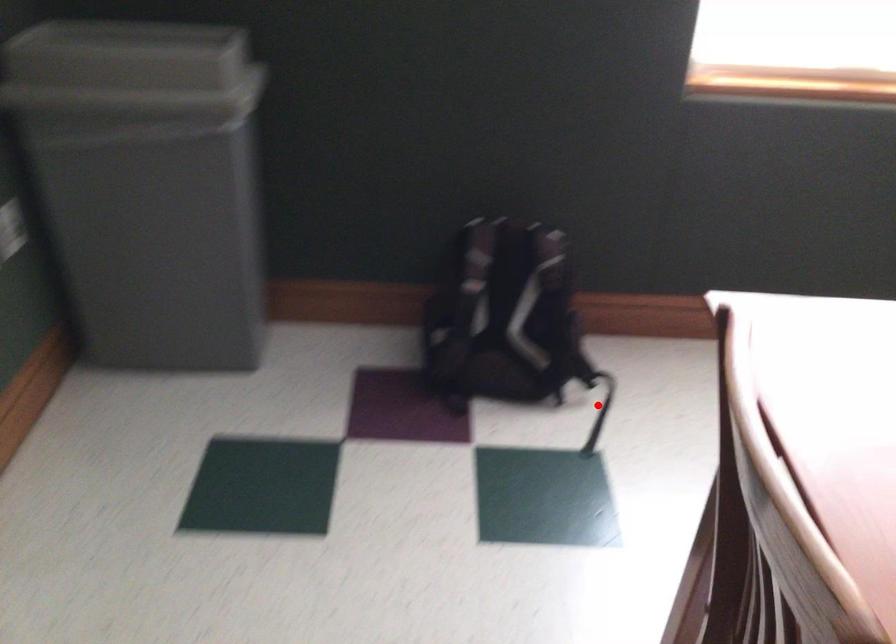
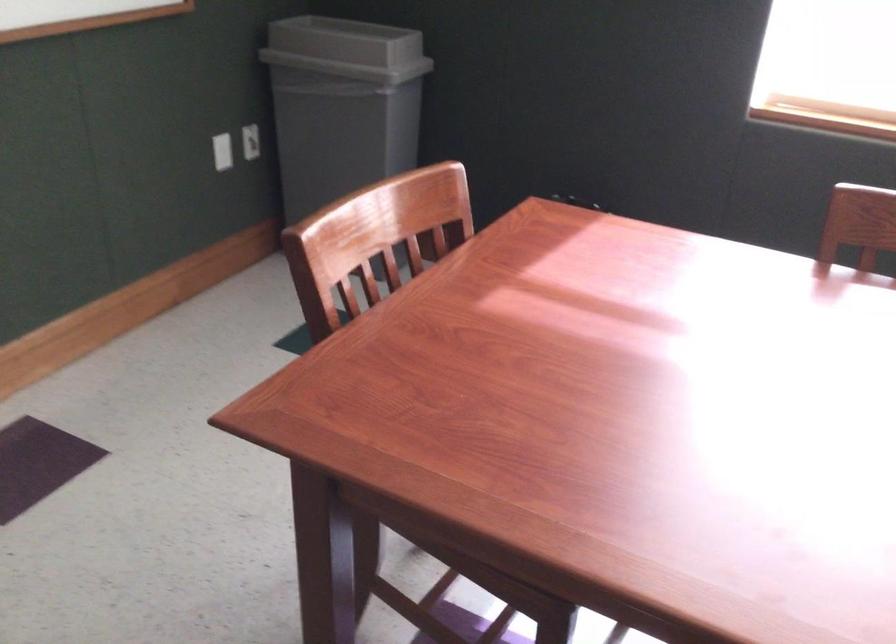
Question: I am providing you with two images of the same scene from different viewpoints. A red point is marked on the first image. Is the red point's position out of view in image 2?

Choices:
 (A) Yes
 (B) No

Answer: (A)